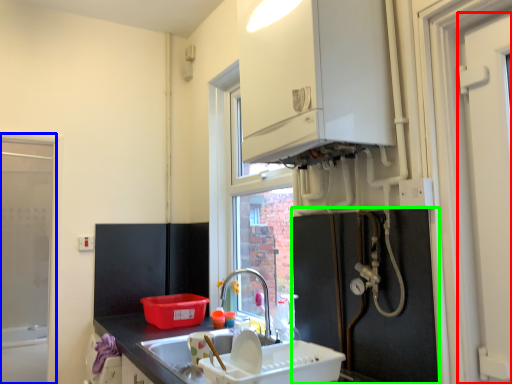
Question: Considering the real-world distances, which object is closest to door (highlighted by a red box)? window frame (highlighted by a blue box) or appliance (highlighted by a green box).

Choices:
 (A) window frame
 (B) appliance

Answer: (B)